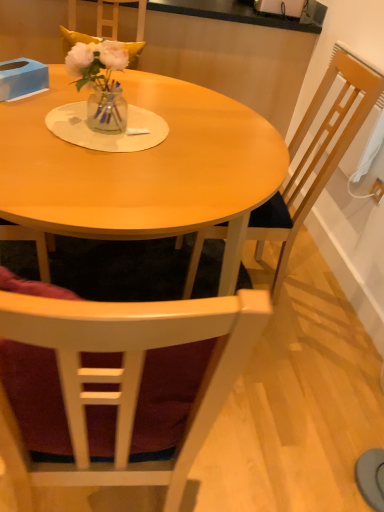
What are the coordinates of `free space above wooden chair at center, the 2th chair positioned from the top (from a real-world perspective)` in the screenshot? It's located at (266, 352).